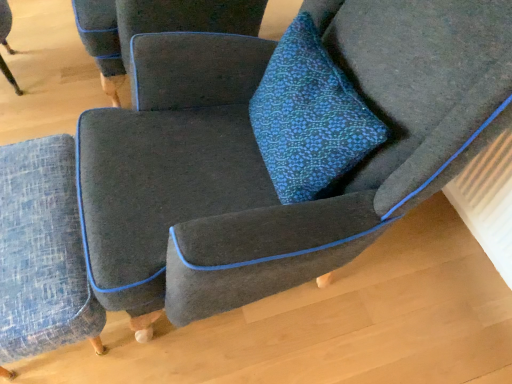
Question: Could you tell me if blue textured cushion at center is facing blue textured ottoman at lower left, the second chair positioned from the top?

Choices:
 (A) yes
 (B) no

Answer: (A)

Question: Can you confirm if blue textured cushion at center is shorter than blue textured ottoman at lower left, which is counted as the 1th chair, starting from the bottom?

Choices:
 (A) yes
 (B) no

Answer: (B)

Question: Is blue textured cushion at center turned away from blue textured ottoman at lower left, which is counted as the 1th chair, starting from the bottom?

Choices:
 (A) no
 (B) yes

Answer: (A)

Question: Is blue textured cushion at center positioned before blue textured ottoman at lower left, which is counted as the 1th chair, starting from the bottom?

Choices:
 (A) no
 (B) yes

Answer: (B)

Question: Is blue textured cushion at center at the right side of blue textured ottoman at lower left, which is counted as the 1th chair, starting from the bottom?

Choices:
 (A) no
 (B) yes

Answer: (B)

Question: Considering the relative positions of blue textured cushion at center and textured gray armchair at center, which appears as the 2th chair when ordered from the bottom, in the image provided, is blue textured cushion at center to the left or to the right of textured gray armchair at center, which appears as the 2th chair when ordered from the bottom,?

Choices:
 (A) left
 (B) right

Answer: (B)

Question: Based on their sizes in the image, would you say blue textured cushion at center is bigger or smaller than textured gray armchair at center, which appears as the 2th chair when ordered from the bottom?

Choices:
 (A) small
 (B) big

Answer: (A)

Question: From a real-world perspective, is blue textured cushion at center positioned above or below textured gray armchair at center, which appears as the 2th chair when ordered from the bottom?

Choices:
 (A) below
 (B) above

Answer: (B)

Question: Considering their positions, is blue textured cushion at center located in front of or behind textured gray armchair at center, which appears as the 2th chair when ordered from the bottom?

Choices:
 (A) front
 (B) behind

Answer: (A)

Question: In the image, is blue textured ottoman at lower left, the second chair positioned from the top, positioned in front of or behind textured gray armchair at center, the 1th chair when ordered from top to bottom?

Choices:
 (A) behind
 (B) front

Answer: (B)

Question: From their relative heights in the image, would you say blue textured ottoman at lower left, which is counted as the 1th chair, starting from the bottom, is taller or shorter than textured gray armchair at center, the 1th chair when ordered from top to bottom?

Choices:
 (A) short
 (B) tall

Answer: (A)

Question: Is point (74, 340) closer or farther from the camera than point (103, 6)?

Choices:
 (A) closer
 (B) farther

Answer: (A)

Question: In terms of width, does blue textured ottoman at lower left, which is counted as the 1th chair, starting from the bottom, look wider or thinner when compared to textured gray armchair at center, the 1th chair when ordered from top to bottom?

Choices:
 (A) wide
 (B) thin

Answer: (B)

Question: Is blue textured ottoman at lower left, the second chair positioned from the top, taller or shorter than blue textured cushion at center?

Choices:
 (A) tall
 (B) short

Answer: (B)

Question: Considering their positions, is blue textured ottoman at lower left, the second chair positioned from the top, located in front of or behind blue textured cushion at center?

Choices:
 (A) behind
 (B) front

Answer: (A)